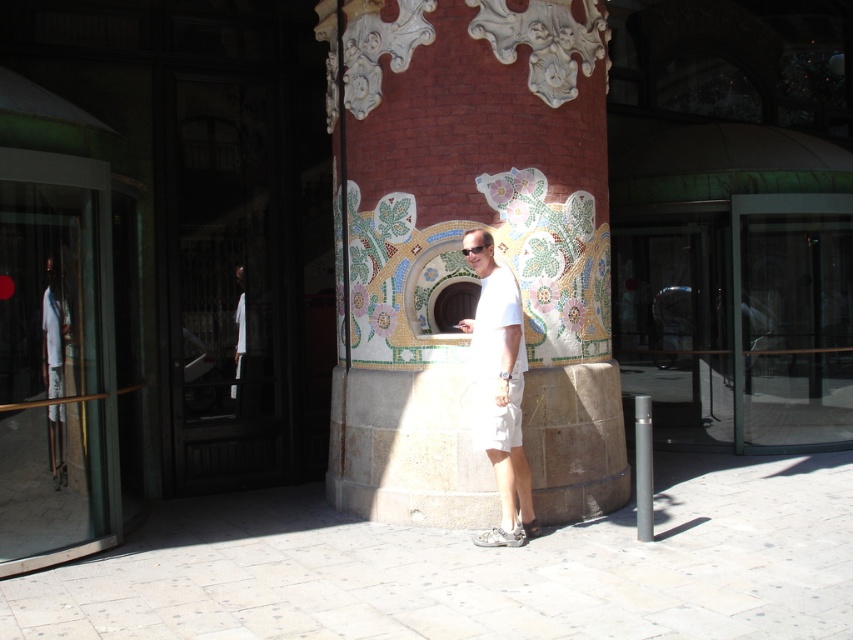
You are standing in a garden and see the transparent glass door at left. Can you walk through it?

Yes, the transparent glass door at left is a door, so you can walk through it.

Based on the photo, you are standing in a hallway and see the transparent glass door at center and the white cotton shirt at left. Which object is closer to your right side?

The transparent glass door at center is to the right of the white cotton shirt at left, so it is closer to your right side.